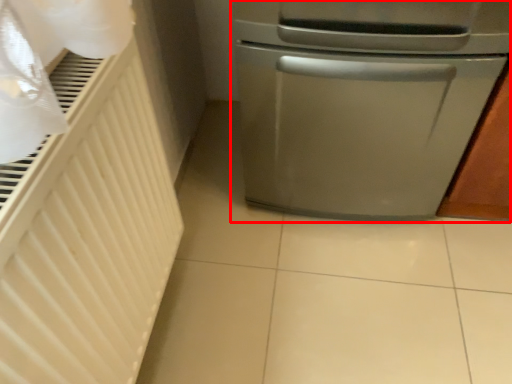
Question: From the image, what is the correct spatial relationship of home appliance (annotated by the red box) in relation to radiator?

Choices:
 (A) right
 (B) left

Answer: (A)